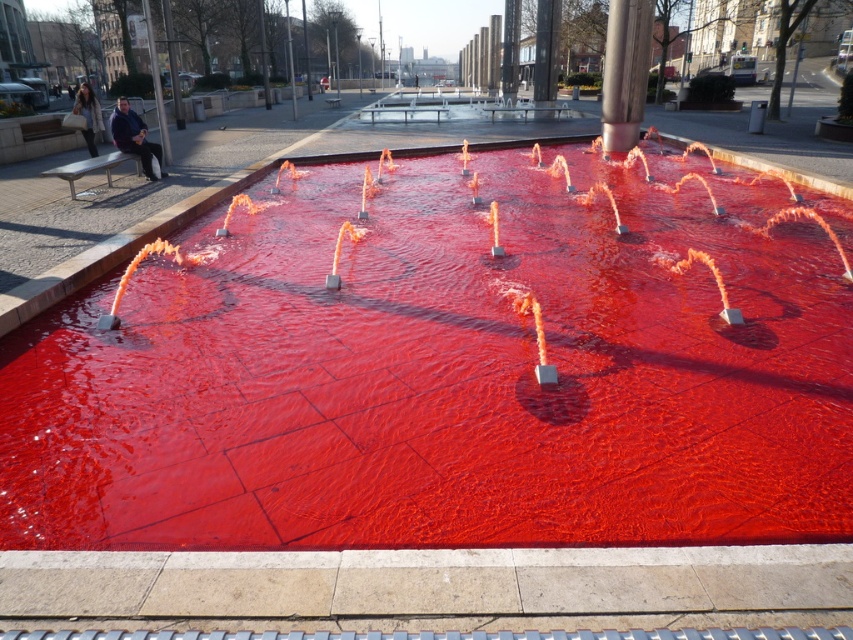
Can you confirm if red glossy water at center is positioned below polished stainless steel pole at center?

Indeed, red glossy water at center is positioned under polished stainless steel pole at center.

Describe the element at coordinates (445, 372) in the screenshot. The image size is (853, 640). I see `red glossy water at center` at that location.

Where is `red glossy water at center`? The image size is (853, 640). red glossy water at center is located at coordinates (445, 372).